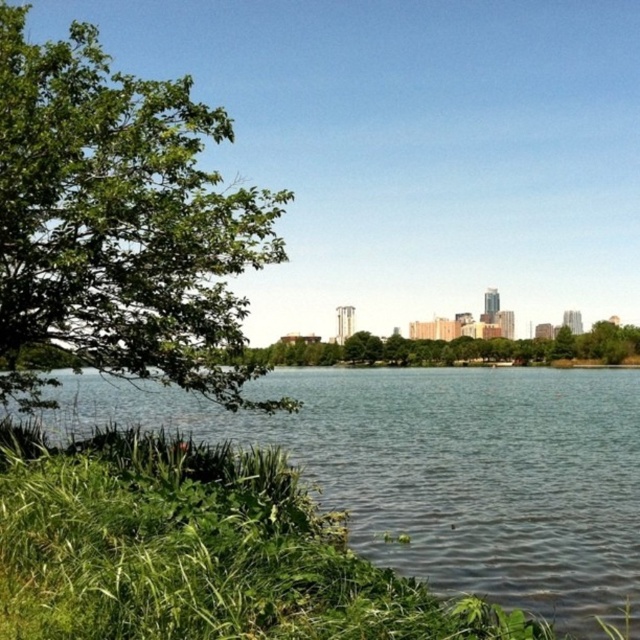
You are an environmental scientist assessing the health of this lakeside area. You notice the green liquid water at lower left and the green leafy tree at left. Which of these two elements has a greater width in the scene?

The green liquid water at lower left has a greater width than the green leafy tree at left according to the description.